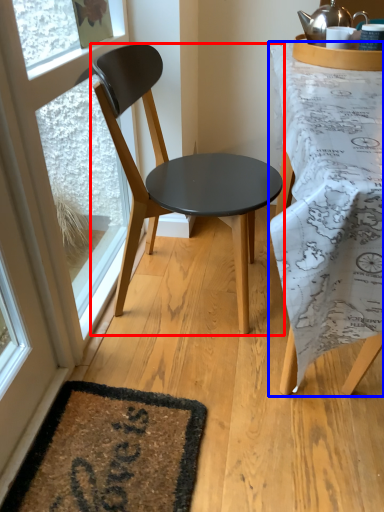
Question: Which object appears closest to the camera in this image, chair (highlighted by a red box) or desk (highlighted by a blue box)?

Choices:
 (A) chair
 (B) desk

Answer: (B)